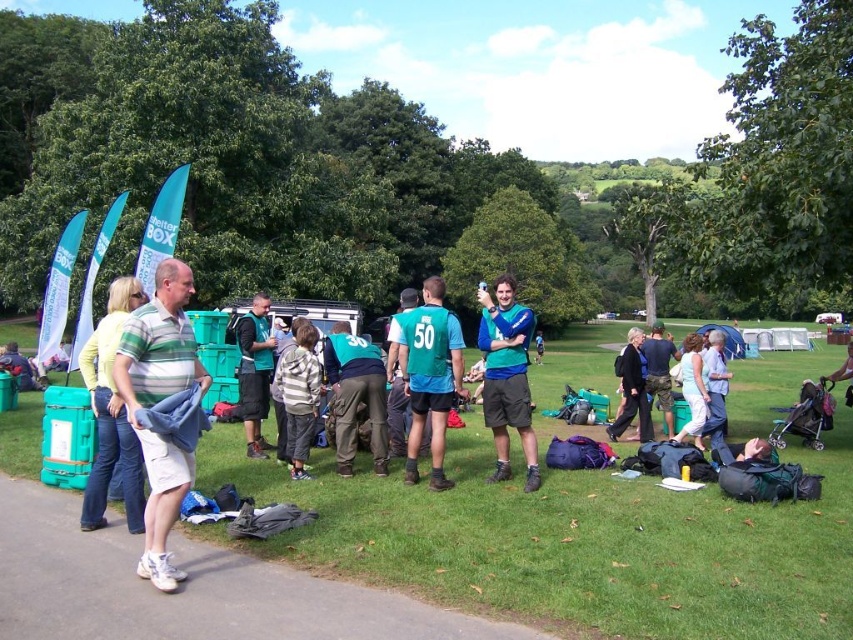
Consider the image. Can you confirm if black fabric jacket at center is positioned to the right of light blue denim shorts at center?

Incorrect, black fabric jacket at center is not on the right side of light blue denim shorts at center.

Does point (640, 401) come in front of point (689, 371)?

No, it is not.

The width and height of the screenshot is (853, 640). Identify the location of black fabric jacket at center. (631, 388).

How much distance is there between yellow-green sweater at left and teal fabric jacket at center?

yellow-green sweater at left is 8.72 feet from teal fabric jacket at center.

Can you confirm if yellow-green sweater at left is wider than teal fabric jacket at center?

Yes, yellow-green sweater at left is wider than teal fabric jacket at center.

Who is more distant from viewer, (103,401) or (341,388)?

Positioned behind is point (341,388).

Locate an element on the screen. This screenshot has height=640, width=853. yellow-green sweater at left is located at coordinates (111, 413).

Does striped cotton shirt at left have a lesser height compared to camouflage pants at center?

No.

Based on the photo, is striped cotton shirt at left wider than camouflage pants at center?

Indeed, striped cotton shirt at left has a greater width compared to camouflage pants at center.

Is point (136, 371) more distant than point (653, 374)?

No, (136, 371) is closer to viewer.

The height and width of the screenshot is (640, 853). What are the coordinates of `striped cotton shirt at left` in the screenshot? It's located at (158, 401).